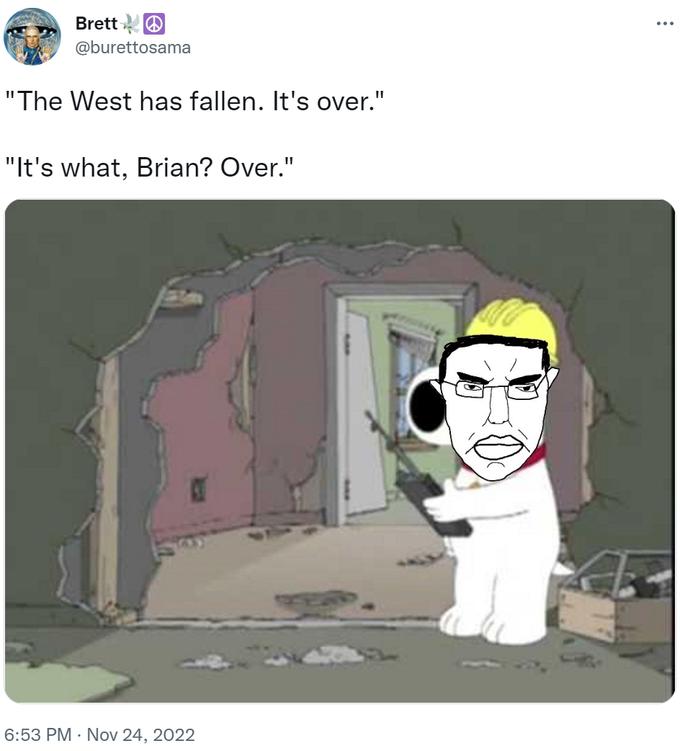
Find the location of a particular element. Image resolution: width=680 pixels, height=751 pixels. unattached door is located at coordinates (356, 366).